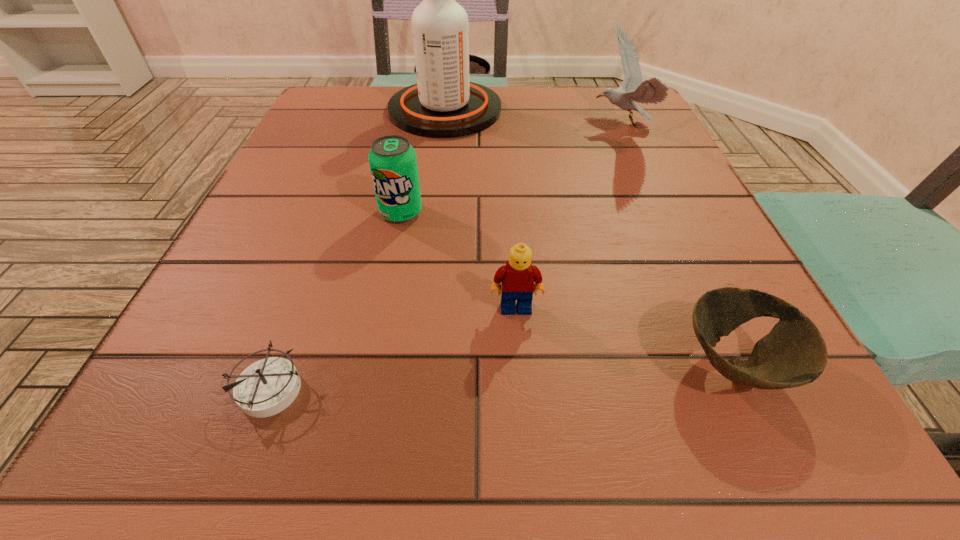
Locate an element on the screen. This screenshot has width=960, height=540. vacant space located 0.110m on the front-facing side of the fourth nearest object is located at coordinates (x=388, y=275).

Where is `free space located on the front-facing side of the Lego`? This screenshot has width=960, height=540. free space located on the front-facing side of the Lego is located at coordinates (519, 354).

You are a GUI agent. You are given a task and a screenshot of the screen. Output one action in this format:
    pyautogui.click(x=<x>, y=<y>)
    Task: Click on the free location located 0.200m on the back of the fifth tallest object
    The height and width of the screenshot is (540, 960).
    Given the screenshot: What is the action you would take?
    pyautogui.click(x=668, y=223)

The width and height of the screenshot is (960, 540). In order to click on vacant region located 0.230m on the right of the compass in this screenshot , I will do `click(506, 388)`.

Locate an element on the screen. cleansing agent that is at the far edge is located at coordinates (443, 104).

Where is `gull positioned at the far edge`? The width and height of the screenshot is (960, 540). gull positioned at the far edge is located at coordinates (652, 91).

The image size is (960, 540). In order to click on bowl at the near edge in this screenshot , I will do `click(794, 353)`.

Locate an element on the screen. compass present at the near edge is located at coordinates (268, 386).

Where is `object located in the left edge section of the desktop`? The width and height of the screenshot is (960, 540). object located in the left edge section of the desktop is located at coordinates (268, 386).

Locate an element on the screen. gull that is at the right edge is located at coordinates (652, 91).